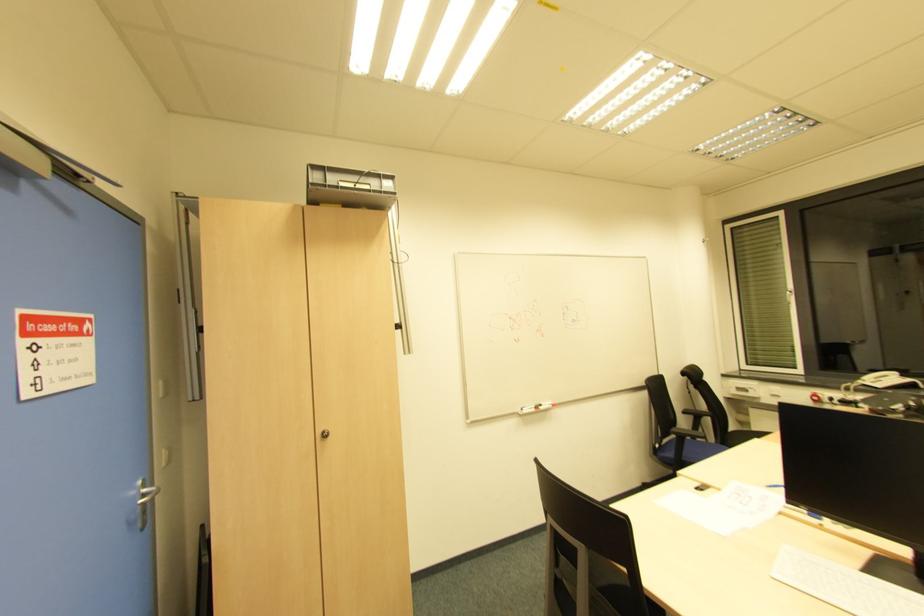
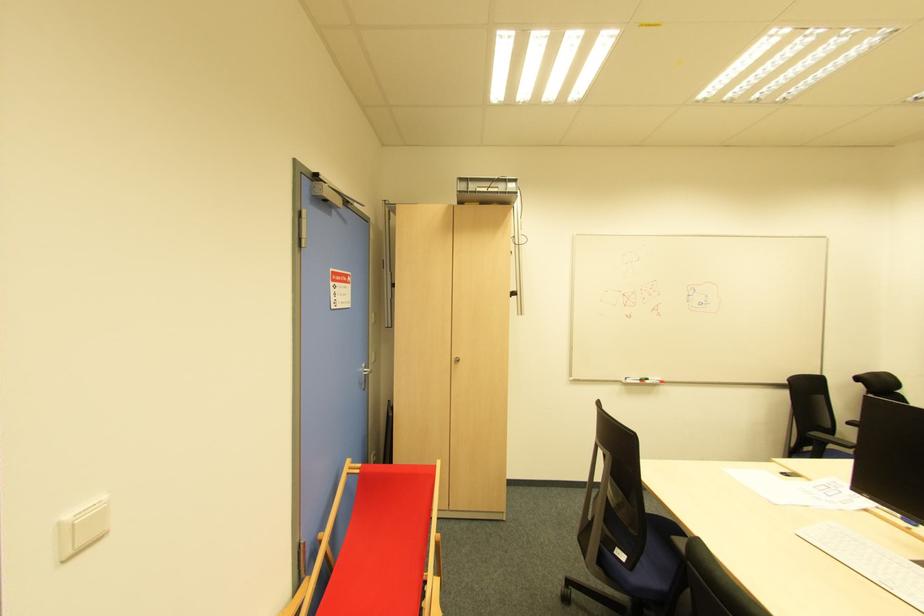
Where in the second image is the point corresponding to (x=674, y=430) from the first image?

(817, 436)